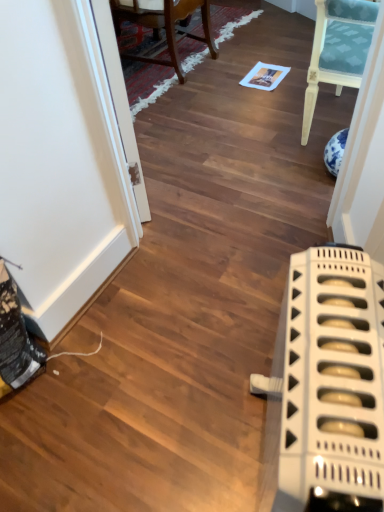
The height and width of the screenshot is (512, 384). I want to click on vacant area to the right of transparent glass door at upper left, so click(x=209, y=153).